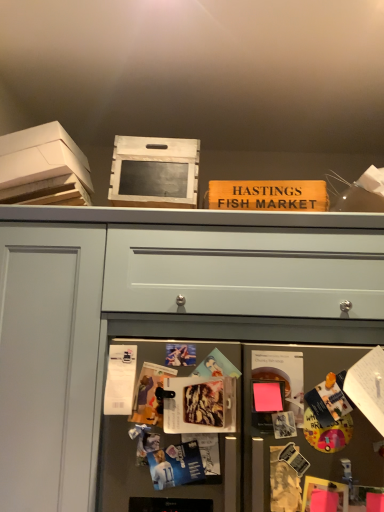
You are a GUI agent. You are given a task and a screenshot of the screen. Output one action in this format:
    pyautogui.click(x=<x>, y=<y>)
    Task: Click on the transparent glass door at upper center
    The height and width of the screenshot is (512, 384).
    Given the screenshot: What is the action you would take?
    pyautogui.click(x=48, y=362)

Locate an element on the screen. metallic gray fridge at lower center is located at coordinates pyautogui.click(x=239, y=426).

Describe the element at coordinates (244, 273) in the screenshot. I see `white matte drawer at center` at that location.

Describe the element at coordinates (43, 168) in the screenshot. The height and width of the screenshot is (512, 384). I see `white cardboard box at upper left` at that location.

Measure the distance between matte paper magazine at center, which is the second magazine in front-to-back order, and camera.

A distance of 3.97 feet exists between matte paper magazine at center, which is the second magazine in front-to-back order, and camera.

Find the location of a particular element. This screenshot has height=512, width=384. matte plastic magazine at center, the first magazine in the bottom-to-top sequence is located at coordinates (199, 405).

Would you say white cardboard box at upper left is inside or outside wooden crate at upper center?

white cardboard box at upper left is located beyond the bounds of wooden crate at upper center.

Is white cardboard box at upper left beside wooden crate at upper center?

No, white cardboard box at upper left is not beside wooden crate at upper center.

From the image's perspective, would you say white cardboard box at upper left is shown under wooden crate at upper center?

No, from the image's perspective, white cardboard box at upper left is not below wooden crate at upper center.

Between white cardboard box at upper left and wooden crate at upper center, which one has larger width?

With larger width is wooden crate at upper center.

From a real-world perspective, between matte paper magazine at center, which appears as the second magazine when ordered from the bottom, and matte plastic magazine at center, the first magazine from the front, who is vertically higher?

From a 3D spatial view, matte paper magazine at center, which appears as the second magazine when ordered from the bottom, is above.

Which is correct: matte paper magazine at center, placed as the 2th magazine when sorted from top to bottom, is inside matte plastic magazine at center, placed as the third magazine when sorted from back to front, or outside of it?

matte paper magazine at center, placed as the 2th magazine when sorted from top to bottom, lies within the bounds of matte plastic magazine at center, placed as the third magazine when sorted from back to front.

Does matte paper magazine at center, which appears as the second magazine when ordered from the bottom, have a greater width compared to matte plastic magazine at center, the 3th magazine when ordered from top to bottom?

No, matte paper magazine at center, which appears as the second magazine when ordered from the bottom, is not wider than matte plastic magazine at center, the 3th magazine when ordered from top to bottom.

Looking at this image, from the image's perspective, is matte paper magazine at center, which is the 2th magazine from back to front, on matte plastic magazine at center, the first magazine from the front?

Yes.

Is white cardboard box at upper left a part of white matte drawer at center?

No, white matte drawer at center does not contain white cardboard box at upper left.

Identify the location of cardboard box behind the white matte drawer at center. (43, 168).

Consider the image. Is white matte drawer at center in contact with white cardboard box at upper left?

No, white matte drawer at center is not beside white cardboard box at upper left.

How distant is white matte drawer at center from white cardboard box at upper left?

They are 17.17 inches apart.

Which object is thinner, wooden sign at upper center, placed as the first magazine when sorted from back to front, or white cardboard box at upper left?

wooden sign at upper center, placed as the first magazine when sorted from back to front.

Is wooden sign at upper center, placed as the first magazine when sorted from back to front, oriented away from white cardboard box at upper left?

wooden sign at upper center, placed as the first magazine when sorted from back to front, does not have its back to white cardboard box at upper left.

Who is bigger, wooden sign at upper center, which is the 3th magazine from bottom to top, or white cardboard box at upper left?

With larger size is white cardboard box at upper left.

Locate an element on the screen. Image resolution: width=384 pixels, height=512 pixels. cardboard box on the left of wooden sign at upper center, placed as the third magazine when sorted from front to back is located at coordinates (43, 168).

How much distance is there between white cardboard box at upper left and white matte drawer at center?

They are 17.17 inches apart.

Is point (49, 162) less distant than point (262, 271)?

No, it is not.

Does white cardboard box at upper left have a larger size compared to white matte drawer at center?

No.

Is white cardboard box at upper left thinner than white matte drawer at center?

Correct, the width of white cardboard box at upper left is less than that of white matte drawer at center.

Looking at this image, considering the relative sizes of matte paper magazine at center, which appears as the second magazine when ordered from the bottom, and wooden sign at upper center, placed as the third magazine when sorted from front to back, in the image provided, is matte paper magazine at center, which appears as the second magazine when ordered from the bottom, smaller than wooden sign at upper center, placed as the third magazine when sorted from front to back,?

Indeed, matte paper magazine at center, which appears as the second magazine when ordered from the bottom, has a smaller size compared to wooden sign at upper center, placed as the third magazine when sorted from front to back.

Is wooden sign at upper center, placed as the first magazine when sorted from back to front, surrounded by matte paper magazine at center, which appears as the second magazine when ordered from the bottom?

Actually, wooden sign at upper center, placed as the first magazine when sorted from back to front, is outside matte paper magazine at center, which appears as the second magazine when ordered from the bottom.

Is matte paper magazine at center, placed as the 2th magazine when sorted from top to bottom, positioned far away from wooden sign at upper center, placed as the third magazine when sorted from front to back?

No.

Relative to transparent glass door at upper center, is white cardboard box at upper left in front or behind?

Visually, white cardboard box at upper left is located behind transparent glass door at upper center.

Which is behind, point (76, 192) or point (76, 311)?

Positioned behind is point (76, 192).

Which of these two, white cardboard box at upper left or transparent glass door at upper center, stands taller?

With more height is transparent glass door at upper center.

Could you tell me if white cardboard box at upper left is facing transparent glass door at upper center?

No, white cardboard box at upper left is not oriented towards transparent glass door at upper center.

Where is `box above the white cardboard box at upper left (from a real-world perspective)`? box above the white cardboard box at upper left (from a real-world perspective) is located at coordinates (154, 172).

In order to click on magazine lying on the left of matte plastic magazine at center, the first magazine from the front in this screenshot , I will do `click(150, 394)`.

Looking at the image, which one is located closer to matte paper magazine at center, placed as the 2th magazine when sorted from top to bottom, white cardboard box at upper left or wooden crate at upper center?

wooden crate at upper center is positioned closer to the anchor matte paper magazine at center, placed as the 2th magazine when sorted from top to bottom.

When comparing their distances from matte paper magazine at center, which is the second magazine in front-to-back order, does white cardboard box at upper left or transparent glass door at upper center seem closer?

Based on the image, transparent glass door at upper center appears to be nearer to matte paper magazine at center, which is the second magazine in front-to-back order.

Looking at the image, which one is located further to matte plastic magazine at center, the first magazine from the front, white cardboard box at upper left or metallic gray fridge at lower center?

white cardboard box at upper left is positioned further to the anchor matte plastic magazine at center, the first magazine from the front.

Which object lies further to the anchor point white matte drawer at center, matte paper magazine at center, which is the 2th magazine from back to front, or white cardboard box at upper left?

Among the two, white cardboard box at upper left is located further to white matte drawer at center.

Looking at the image, which one is located closer to metallic gray fridge at lower center, wooden sign at upper center, placed as the first magazine when sorted from back to front, or wooden crate at upper center?

Based on the image, wooden sign at upper center, placed as the first magazine when sorted from back to front, appears to be nearer to metallic gray fridge at lower center.

Considering their positions, is wooden crate at upper center positioned closer to matte paper magazine at center, which appears as the second magazine when ordered from the bottom, than white cardboard box at upper left?

The object closer to matte paper magazine at center, which appears as the second magazine when ordered from the bottom, is wooden crate at upper center.

Looking at the image, which one is located further to matte plastic magazine at center, the 3th magazine when ordered from top to bottom, transparent glass door at upper center or white matte drawer at center?

The object further to matte plastic magazine at center, the 3th magazine when ordered from top to bottom, is transparent glass door at upper center.

From the picture: Looking at the image, which one is located further to wooden sign at upper center, which is the 3th magazine from bottom to top, matte plastic magazine at center, placed as the third magazine when sorted from back to front, or transparent glass door at upper center?

transparent glass door at upper center lies further to wooden sign at upper center, which is the 3th magazine from bottom to top, than the other object.

The image size is (384, 512). In order to click on fridge between white cardboard box at upper left and white matte drawer at center in this screenshot , I will do `click(239, 426)`.

At what (x,y) coordinates should I click in order to perform the action: click on drawer situated between transparent glass door at upper center and wooden sign at upper center, placed as the 1th magazine when sorted from top to bottom, from left to right. Please return your answer as a coordinate pair (x, y). Looking at the image, I should click on (244, 273).

Locate an element on the screen. The width and height of the screenshot is (384, 512). magazine between wooden crate at upper center and matte paper magazine at center, which is the second magazine in front-to-back order, vertically is located at coordinates (268, 195).

Locate an element on the screen. The height and width of the screenshot is (512, 384). drawer that lies between wooden sign at upper center, placed as the first magazine when sorted from back to front, and matte plastic magazine at center, the first magazine in the bottom-to-top sequence, from top to bottom is located at coordinates click(x=244, y=273).